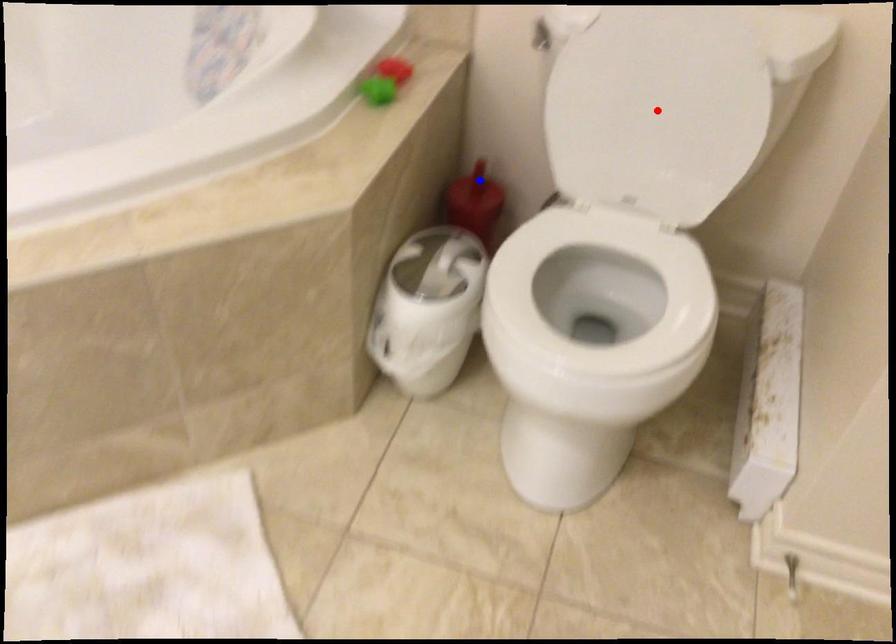
Question: In the image, two points are highlighted. Which point is nearer to the camera? Reply with the corresponding letter.

Choices:
 (A) blue point
 (B) red point

Answer: (B)